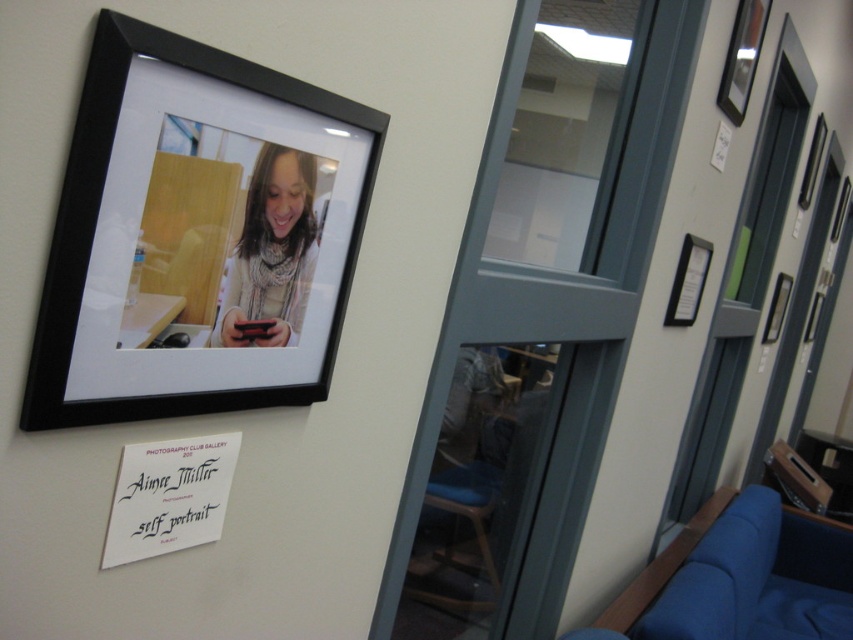
Is matte black phone at center further to camera compared to matte black picture frame at upper right?

No, matte black phone at center is in front of matte black picture frame at upper right.

Who is more distant from viewer, (294, 177) or (722, 72)?

Point (722, 72)

Find the location of `matte black phone at center`. matte black phone at center is located at coordinates (271, 252).

Image resolution: width=853 pixels, height=640 pixels. I want to click on black matte picture frame at upper left, so click(x=196, y=236).

Does black matte picture frame at upper left have a larger size compared to matte black picture frame at upper right?

Yes, black matte picture frame at upper left is bigger than matte black picture frame at upper right.

Who is more forward, [155,76] or [746,68]?

Positioned in front is point [155,76].

The width and height of the screenshot is (853, 640). What are the coordinates of `black matte picture frame at upper left` in the screenshot? It's located at (196, 236).

Does black matte picture frame at upper left come behind matte black phone at center?

No, black matte picture frame at upper left is in front of matte black phone at center.

Is black matte picture frame at upper left taller than matte black phone at center?

Correct, black matte picture frame at upper left is much taller as matte black phone at center.

Identify the location of black matte picture frame at upper left. pyautogui.click(x=196, y=236).